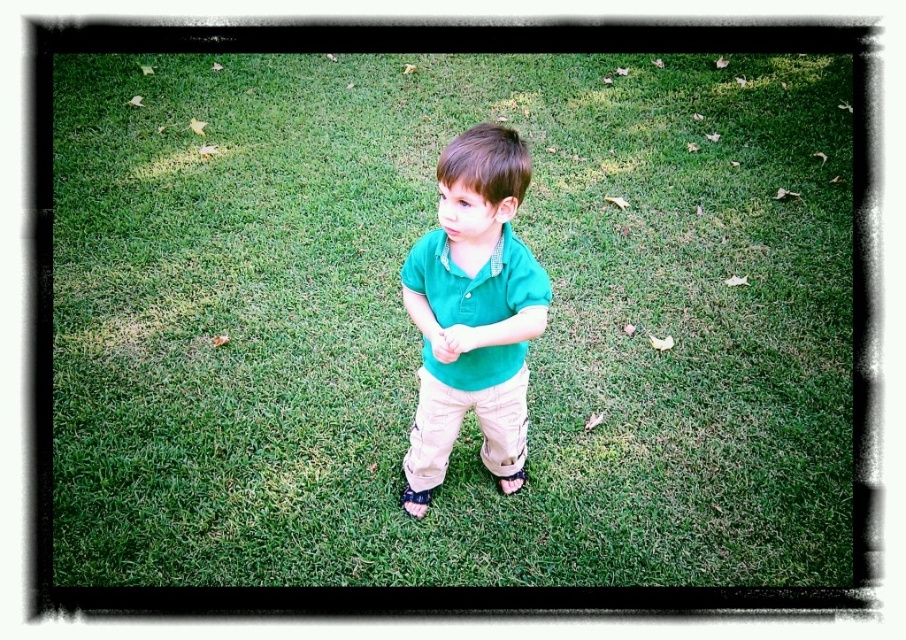
Does green cotton shirt at center appear under khaki cotton pants at center?

Incorrect, green cotton shirt at center is not positioned below khaki cotton pants at center.

Identify the location of green cotton shirt at center. The height and width of the screenshot is (640, 906). (474, 305).

You are a GUI agent. You are given a task and a screenshot of the screen. Output one action in this format:
    pyautogui.click(x=<x>, y=<y>)
    Task: Click on the green cotton shirt at center
    Image resolution: width=906 pixels, height=640 pixels.
    Given the screenshot: What is the action you would take?
    pyautogui.click(x=474, y=305)

What are the coordinates of `green cotton shirt at center` in the screenshot? It's located at (474, 305).

Is point (630, 346) closer to camera compared to point (506, 493)?

No, (630, 346) is further to viewer.

Who is more distant from viewer, (635, 371) or (509, 493)?

Positioned behind is point (635, 371).

The image size is (906, 640). Find the location of `green grass at center`. green grass at center is located at coordinates (449, 320).

Does green cotton shirt at center have a larger size compared to green cotton polo shirt at center?

Indeed, green cotton shirt at center has a larger size compared to green cotton polo shirt at center.

Can you confirm if green cotton shirt at center is shorter than green cotton polo shirt at center?

In fact, green cotton shirt at center may be taller than green cotton polo shirt at center.

This screenshot has height=640, width=906. In order to click on green cotton shirt at center in this screenshot , I will do `click(474, 305)`.

This screenshot has height=640, width=906. I want to click on green cotton shirt at center, so click(474, 305).